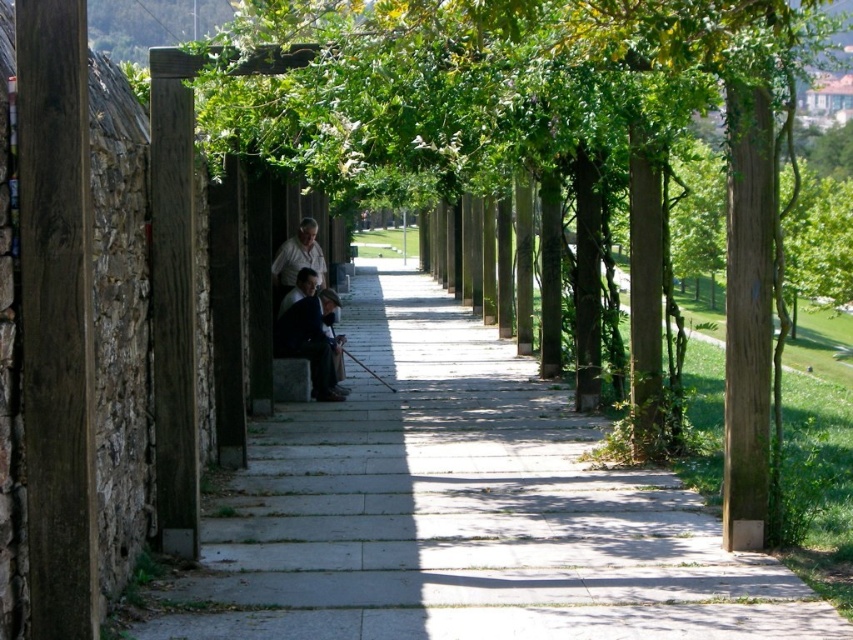
How distant is dark gray suit at center from matte black jacket at center?

The distance of dark gray suit at center from matte black jacket at center is 28.69 inches.

At what (x,y) coordinates should I click in order to perform the action: click on dark gray suit at center. Please return your answer as a coordinate pair (x, y). Looking at the image, I should click on (309, 333).

Between gray concrete pavement at center and matte black jacket at center, which one appears on the left side from the viewer's perspective?

From the viewer's perspective, matte black jacket at center appears more on the left side.

Which is above, gray concrete pavement at center or matte black jacket at center?

Positioned higher is matte black jacket at center.

Is point (659, 548) in front of point (309, 256)?

Yes.

This screenshot has width=853, height=640. In order to click on gray concrete pavement at center in this screenshot , I will do `click(463, 509)`.

Who is more forward, [708,604] or [326,358]?

Point [708,604] is in front.

Find the location of `gray concrete pavement at center`. gray concrete pavement at center is located at coordinates (463, 509).

Describe the element at coordinates (463, 509) in the screenshot. I see `gray concrete pavement at center` at that location.

Identify the location of gray concrete pavement at center. (463, 509).